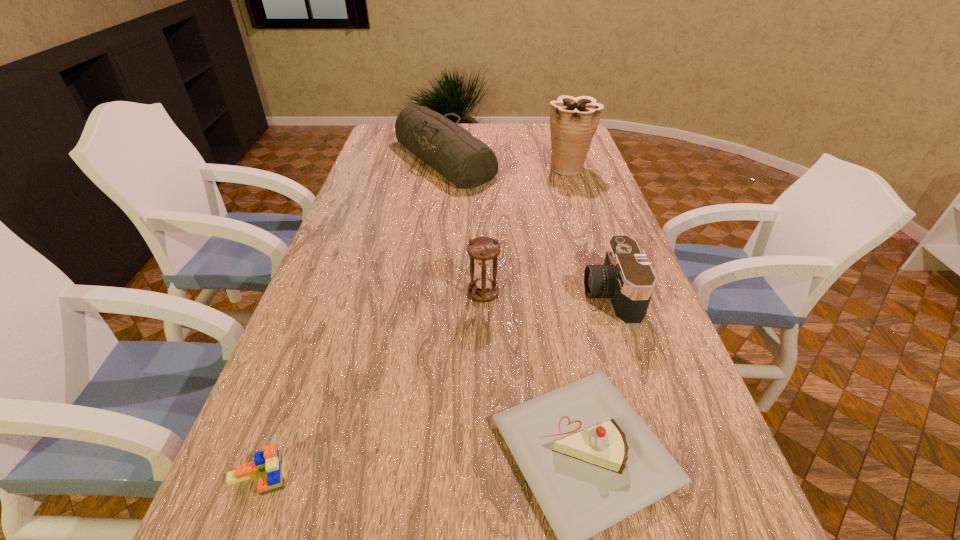
Where is `the tallest object`? This screenshot has height=540, width=960. the tallest object is located at coordinates (573, 121).

Find the location of `duffel bag`. duffel bag is located at coordinates (466, 161).

At what (x,y) coordinates should I click in order to perform the action: click on hourglass. Please return your answer as a coordinate pair (x, y). Image resolution: width=960 pixels, height=540 pixels. Looking at the image, I should click on (484, 250).

At what (x,y) coordinates should I click in order to perform the action: click on the third shortest object. Please return your answer as a coordinate pair (x, y). Looking at the image, I should click on click(x=626, y=278).

This screenshot has width=960, height=540. In order to click on the shortest object in this screenshot , I will do `click(270, 461)`.

Find the location of a particular element. Image resolution: width=960 pixels, height=540 pixels. vacant space located on the front of the urn is located at coordinates (578, 199).

This screenshot has width=960, height=540. What are the coordinates of `blank area located 0.400m on the right of the duffel bag` in the screenshot? It's located at (596, 159).

Find the location of a particular element. The width and height of the screenshot is (960, 540). vacant region located on the front of the hourglass is located at coordinates (484, 329).

What are the coordinates of `blank space located on the front-facing side of the third shortest object` in the screenshot? It's located at (528, 295).

I want to click on vacant area situated on the front-facing side of the third shortest object, so click(434, 295).